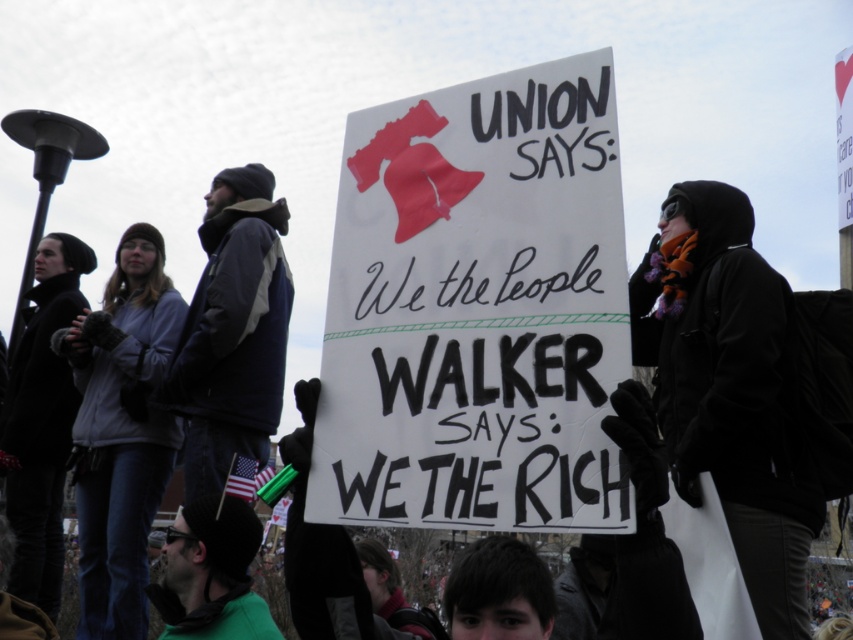
Is light blue fleece jacket at center-left smaller than dark blue jacket at center?

Incorrect, light blue fleece jacket at center-left is not smaller in size than dark blue jacket at center.

Does light blue fleece jacket at center-left have a lesser width compared to dark blue jacket at center?

In fact, light blue fleece jacket at center-left might be wider than dark blue jacket at center.

Where is `light blue fleece jacket at center-left`? This screenshot has height=640, width=853. light blue fleece jacket at center-left is located at coordinates pos(120,432).

What are the coordinates of `light blue fleece jacket at center-left` in the screenshot? It's located at (120, 432).

Who is more distant from viewer, (785, 531) or (257, 417)?

Point (257, 417)

Does black woolen scarf at right appear over dark blue jacket at center?

Actually, black woolen scarf at right is below dark blue jacket at center.

The height and width of the screenshot is (640, 853). Describe the element at coordinates (729, 388) in the screenshot. I see `black woolen scarf at right` at that location.

Find the location of a particular element. black woolen scarf at right is located at coordinates (729, 388).

Between white paper sign at center and light blue fleece jacket at center-left, which one has less height?

white paper sign at center is shorter.

Is white paper sign at center taller than light blue fleece jacket at center-left?

No.

Which is behind, point (602, 252) or point (134, 276)?

Positioned behind is point (134, 276).

Where is `white paper sign at center`? Image resolution: width=853 pixels, height=640 pixels. white paper sign at center is located at coordinates (477, 308).